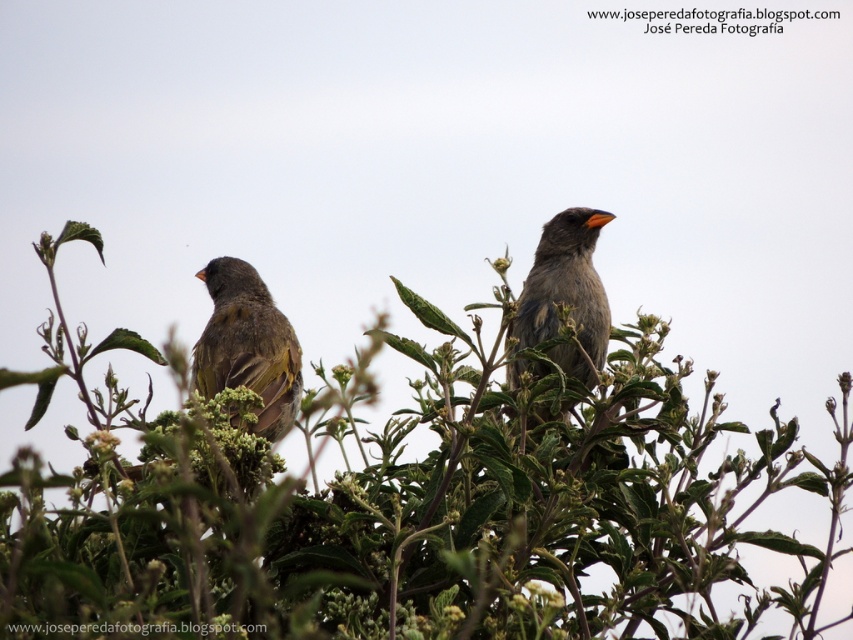
Between point (267, 384) and point (544, 323), which one is positioned in front?

Point (267, 384) is in front.

Image resolution: width=853 pixels, height=640 pixels. I want to click on greenish-brown feathers at left, so click(x=247, y=346).

Locate an element on the screen. greenish-brown feathers at left is located at coordinates (247, 346).